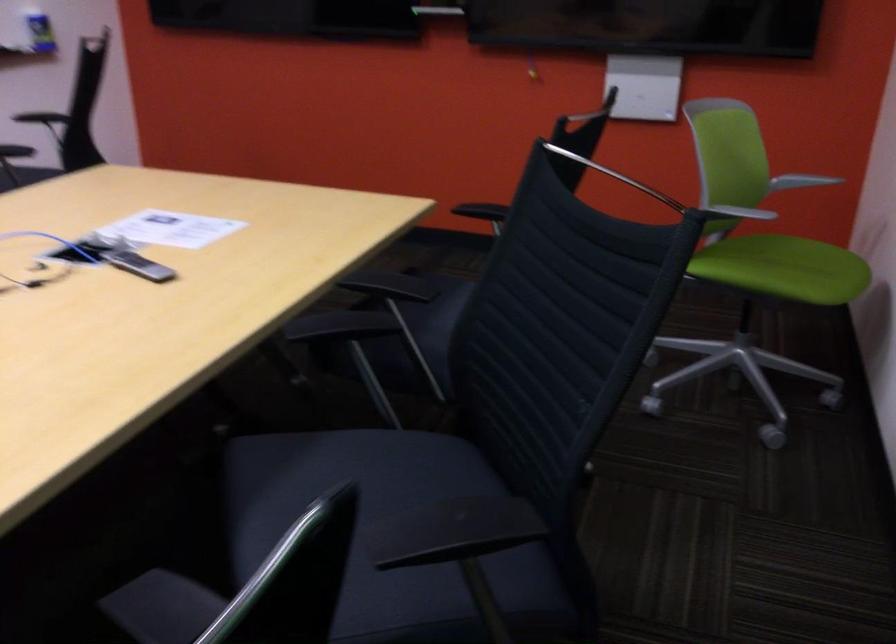
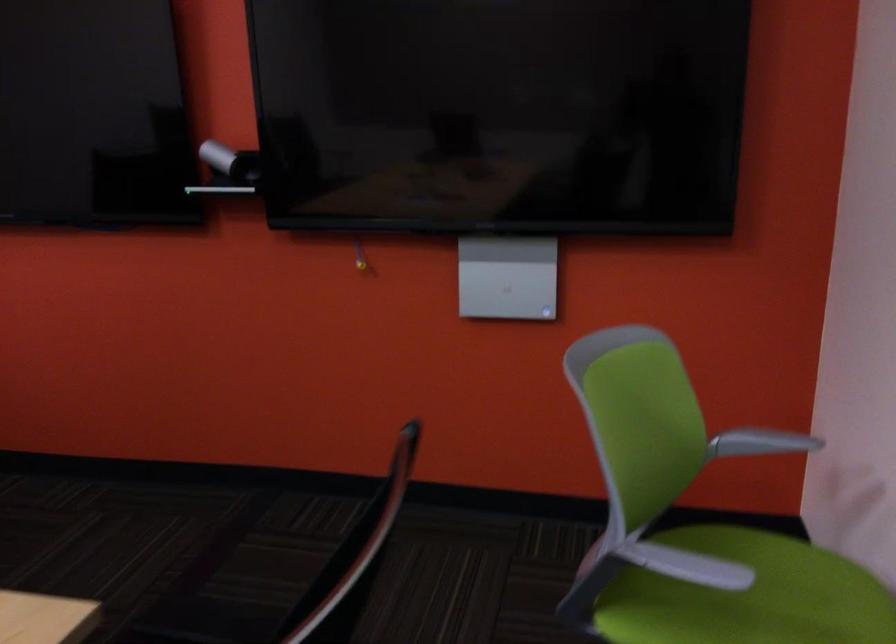
Find the pixel in the second image that matches [806,181] in the first image.

(760, 442)